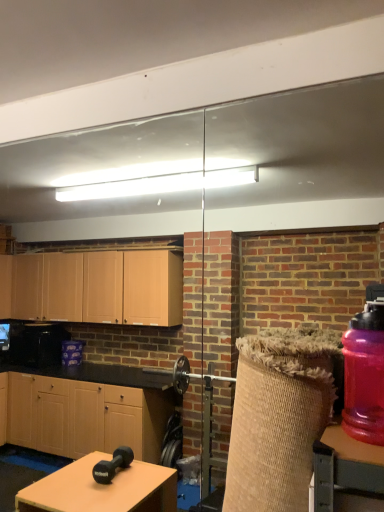
Question: From the image's perspective, is wooden table at center above or below purple translucent bottle at right?

Choices:
 (A) below
 (B) above

Answer: (A)

Question: In terms of height, does wooden table at center look taller or shorter compared to purple translucent bottle at right?

Choices:
 (A) short
 (B) tall

Answer: (A)

Question: Is wooden table at center inside the boundaries of purple translucent bottle at right, or outside?

Choices:
 (A) inside
 (B) outside

Answer: (B)

Question: From the image's perspective, is purple translucent bottle at right positioned above or below wooden table at center?

Choices:
 (A) above
 (B) below

Answer: (A)

Question: From a real-world perspective, is purple translucent bottle at right physically located above or below wooden table at center?

Choices:
 (A) above
 (B) below

Answer: (A)

Question: In terms of width, does purple translucent bottle at right look wider or thinner when compared to wooden table at center?

Choices:
 (A) thin
 (B) wide

Answer: (B)

Question: Which is correct: purple translucent bottle at right is inside wooden table at center, or outside of it?

Choices:
 (A) outside
 (B) inside

Answer: (A)